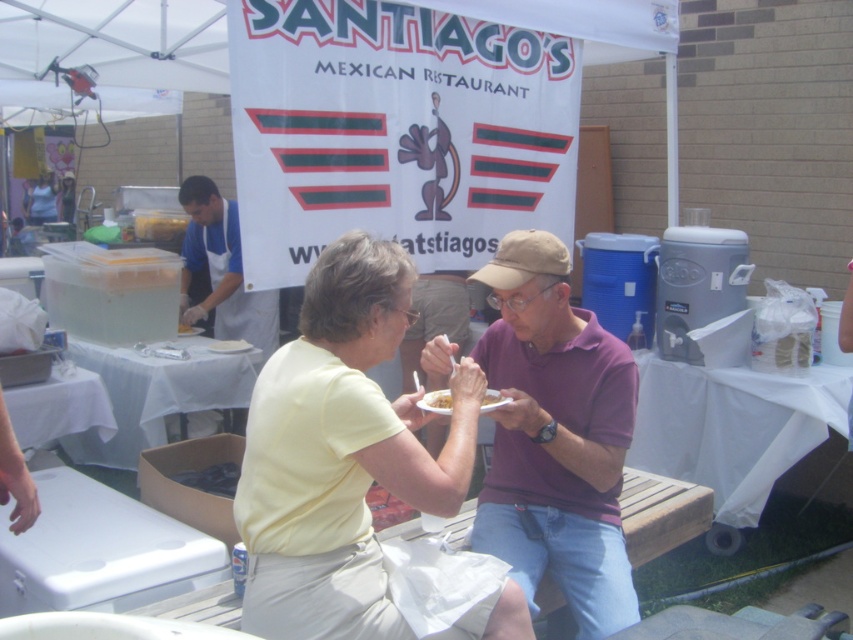
Question: Is yellow fabric shirt at center to the left of purple cotton shirt at center from the viewer's perspective?

Choices:
 (A) yes
 (B) no

Answer: (A)

Question: In this image, where is yellow fabric shirt at center located relative to purple cotton shirt at center?

Choices:
 (A) below
 (B) above

Answer: (B)

Question: Which is farther from the white apron at left?

Choices:
 (A) yellow matte plate at center
 (B) purple cotton shirt at center
 (C) yellow fabric shirt at center

Answer: (C)

Question: Which point is farther to the camera?

Choices:
 (A) (521, 403)
 (B) (442, 392)
 (C) (234, 320)
 (D) (421, 476)

Answer: (C)

Question: Can you confirm if yellow fabric shirt at center is wider than yellow matte plate at center?

Choices:
 (A) yes
 (B) no

Answer: (A)

Question: Among these points, which one is nearest to the camera?

Choices:
 (A) (312, 561)
 (B) (596, 564)

Answer: (A)